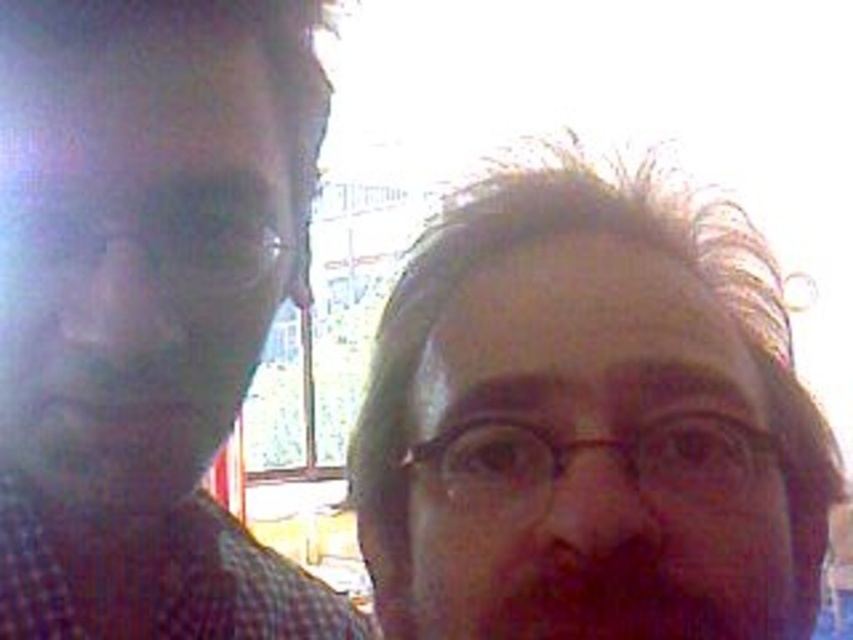
You are a photographer trying to adjust the framing of this image. Since the matte plastic face at center and the matte black shirt at left are both in the shot, which one should you focus on to ensure proper exposure given their size difference?

The matte plastic face at center has a lesser height compared to the matte black shirt at left, so you should focus on the matte black shirt at left for proper exposure since it is larger in the frame.

You are a photographer trying to capture a clear portrait of the person in the image. The matte plastic face at center and the matte black shirt at left are both in the frame. Which object should you adjust your focus to ensure the person is clearly visible?

The matte plastic face at center is in front of the matte black shirt at left, so focusing on the matte plastic face at center will ensure the person is clearly visible.